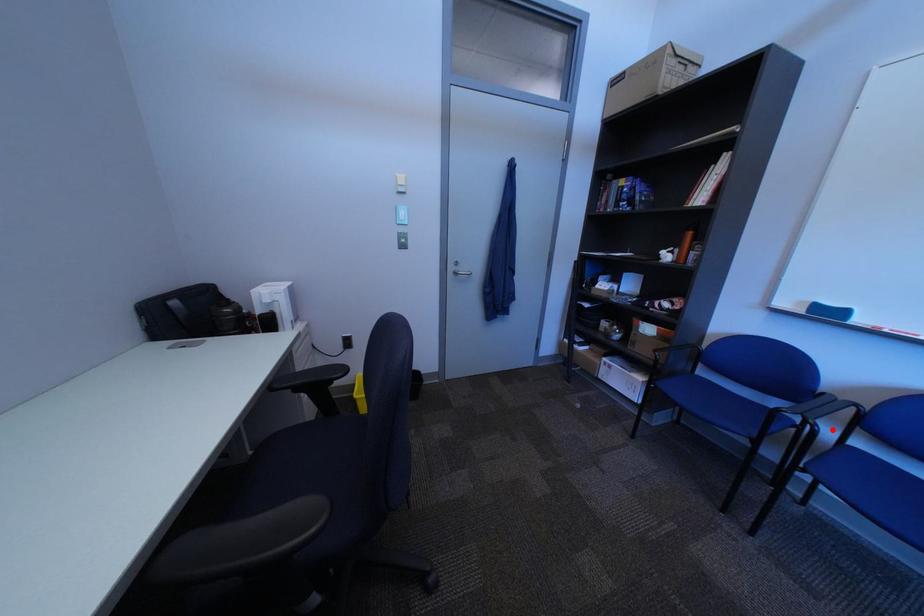
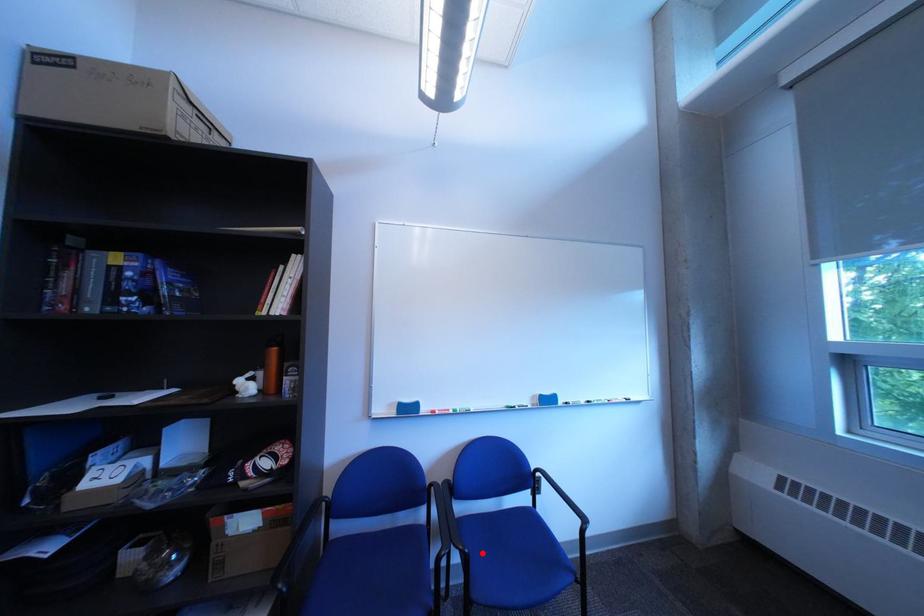
I am providing you with two images of the same scene from different viewpoints. A red point is marked on the first image and another point is marked on the second image. Do the highlighted points in image1 and image2 indicate the same real-world spot?

Yes